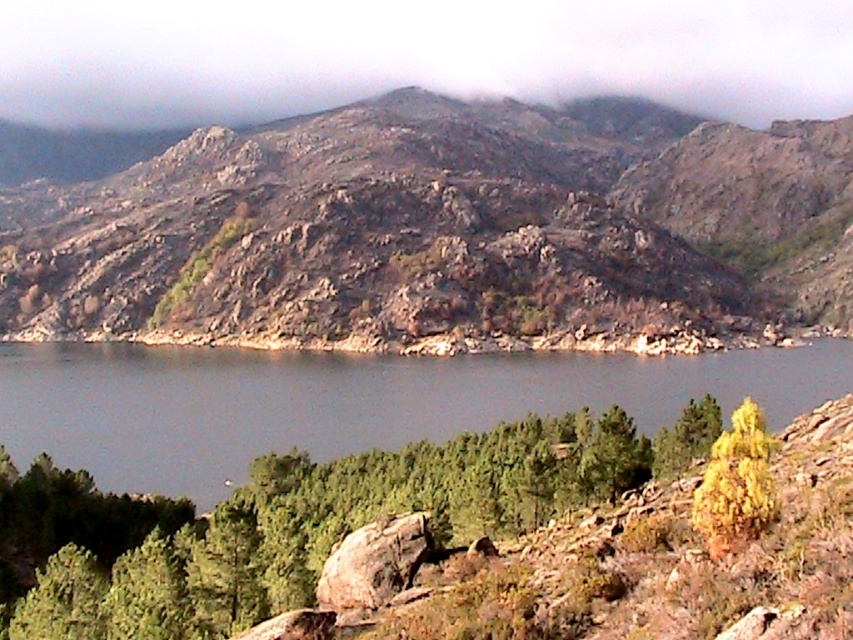
Does green textured rock at center have a larger size compared to rusty rock at center?

Correct, green textured rock at center is larger in size than rusty rock at center.

Can you confirm if green textured rock at center is smaller than rusty rock at center?

No, green textured rock at center is not smaller than rusty rock at center.

The image size is (853, 640). Describe the element at coordinates (341, 508) in the screenshot. I see `green textured rock at center` at that location.

Locate an element on the screen. The width and height of the screenshot is (853, 640). green textured rock at center is located at coordinates (341, 508).

Can you confirm if gray smooth water at center is taller than yellow-green leafy bush at center-right?

Correct, gray smooth water at center is much taller as yellow-green leafy bush at center-right.

Consider the image. Does gray smooth water at center appear on the right side of yellow-green leafy bush at center-right?

In fact, gray smooth water at center is to the left of yellow-green leafy bush at center-right.

Between point (695, 376) and point (733, 461), which one is positioned in front?

Point (733, 461) is in front.

This screenshot has height=640, width=853. I want to click on gray smooth water at center, so [x=347, y=401].

Who is more distant from viewer, (786, 262) or (838, 364)?

The point (786, 262) is behind.

Consider the image. Between rugged stone mountain at upper center and gray smooth water at center, which one appears on the right side from the viewer's perspective?

From the viewer's perspective, gray smooth water at center appears more on the right side.

The height and width of the screenshot is (640, 853). What do you see at coordinates (444, 232) in the screenshot?
I see `rugged stone mountain at upper center` at bounding box center [444, 232].

Locate an element on the screen. rugged stone mountain at upper center is located at coordinates (444, 232).